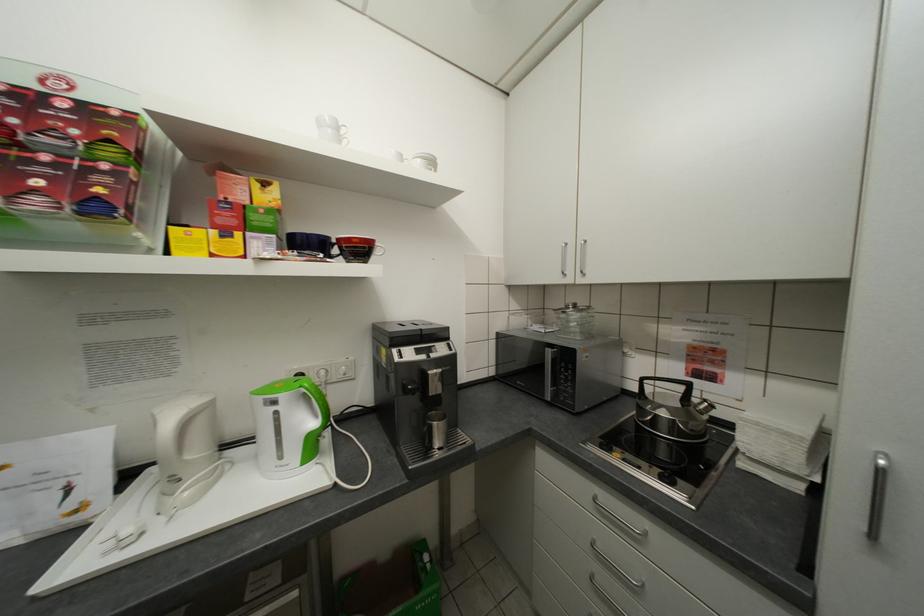
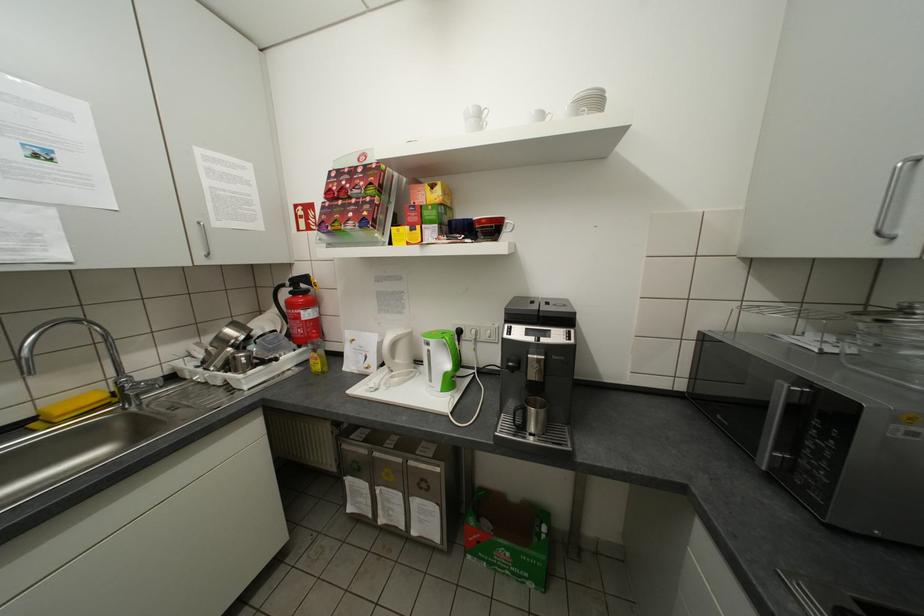
Where in the second image is the point corresponding to point 310,387 from the first image?

(452, 338)